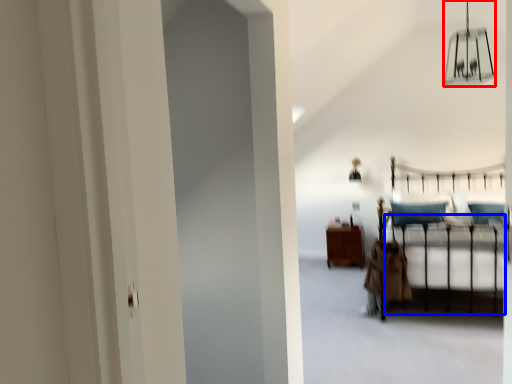
Question: Which object is further to the camera taking this photo, lamp (highlighted by a red box) or bed frame (highlighted by a blue box)?

Choices:
 (A) lamp
 (B) bed frame

Answer: (B)